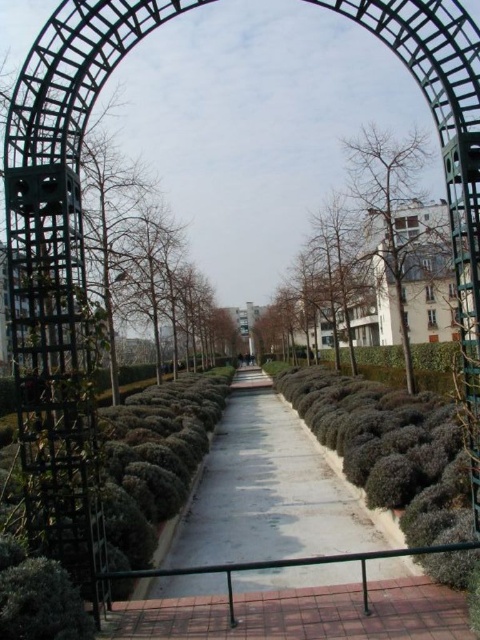
You are a landscape architect designing a wheelchair ramp that must be at least 2 inches high. You observe the smooth concrete path at center and the bare branches at center in the scene. Which object meets the minimum height requirement for the ramp?

The smooth concrete path at center has a greater height compared to the bare branches at center, so it meets the minimum height requirement of 2 inches for the wheelchair ramp.

You are standing at the entrance of the garden and want to walk towards the trellis on the left. Which object should you step on first, the smooth concrete path at center or the bare branches at center?

The smooth concrete path at center is to the left of the bare branches at center, so you should step on the smooth concrete path at center first before reaching the bare branches at center.